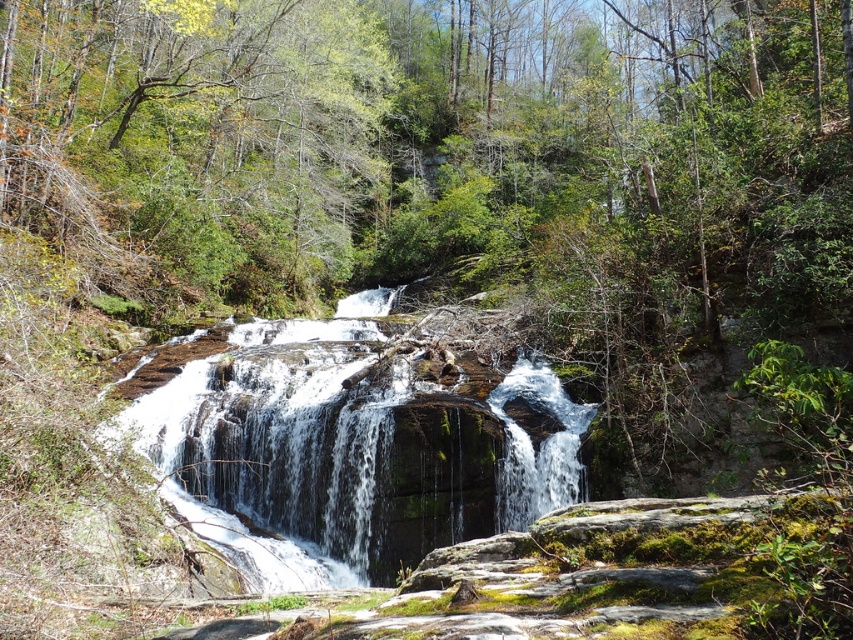
Is green leafy tree at upper left to the right of green mossy rock at center from the viewer's perspective?

In fact, green leafy tree at upper left is to the left of green mossy rock at center.

Who is lower down, green leafy tree at upper left or green mossy rock at center?

green mossy rock at center is below.

Where is `green leafy tree at upper left`? The image size is (853, 640). green leafy tree at upper left is located at coordinates (193, 141).

Identify the location of green leafy tree at upper left. This screenshot has width=853, height=640. (193, 141).